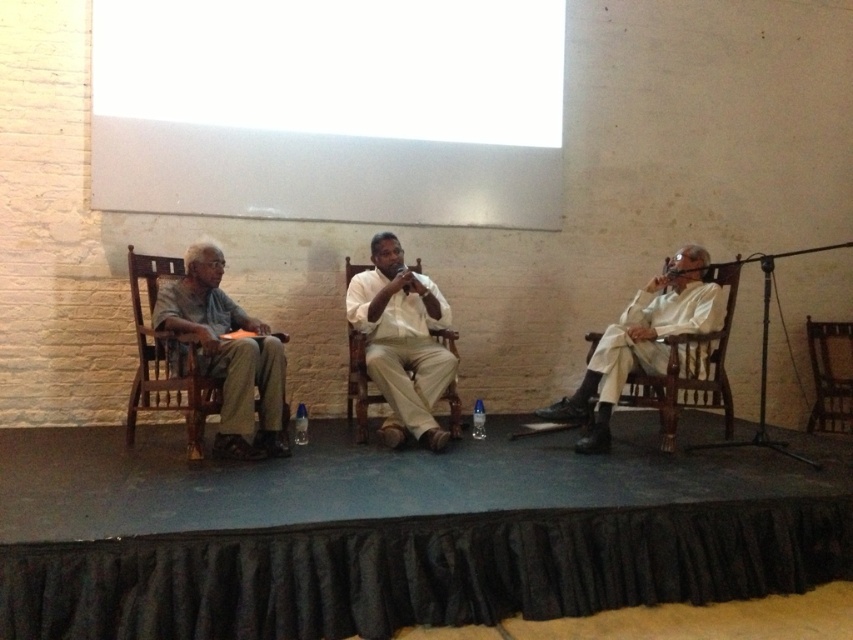
From the picture: Is wooden at right below wooden at center?

No, wooden at right is not below wooden at center.

Can you confirm if wooden at right is positioned to the right of wooden at center?

Incorrect, wooden at right is not on the right side of wooden at center.

Which is in front, point (682, 256) or point (830, 397)?

Positioned in front is point (682, 256).

This screenshot has width=853, height=640. In order to click on wooden at right in this screenshot , I will do pyautogui.click(x=665, y=346).

Is wooden chair at left above wooden at right?

Indeed, wooden chair at left is positioned over wooden at right.

Does wooden chair at left come in front of wooden at right?

Yes, wooden chair at left is closer to the viewer.

Is point (242, 314) closer to viewer compared to point (672, 438)?

No.

In order to click on wooden chair at left in this screenshot , I will do `click(209, 353)`.

Does point (132, 400) come behind point (849, 410)?

No, (132, 400) is closer to viewer.

At what (x,y) coordinates should I click in order to perform the action: click on wooden chair at left. Please return your answer as a coordinate pair (x, y). Looking at the image, I should click on (209, 353).